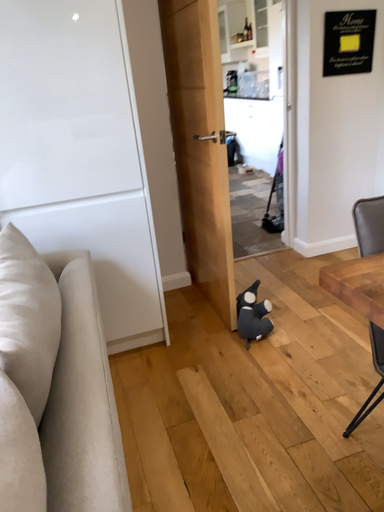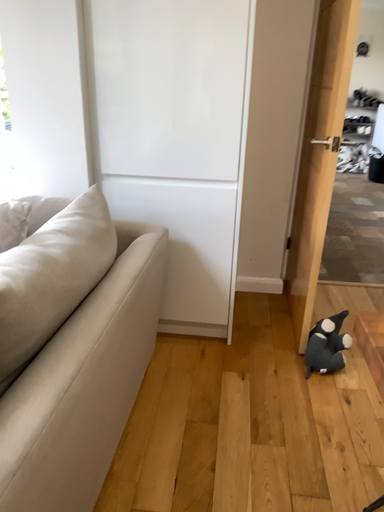
Question: How did the camera likely rotate when shooting the video?

Choices:
 (A) rotated left
 (B) rotated right

Answer: (A)